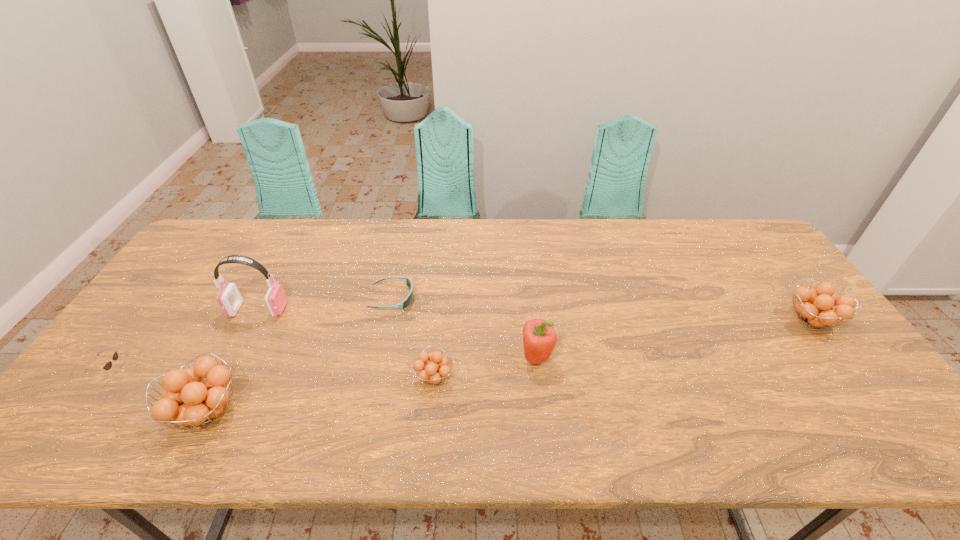
The height and width of the screenshot is (540, 960). Find the location of `the tallest object`. the tallest object is located at coordinates (229, 298).

In order to click on vacant area situated 0.380m on the right of the leftmost orange fruit in this screenshot , I will do `click(408, 411)`.

This screenshot has height=540, width=960. In order to click on free space located 0.090m on the left of the third object from right to left in this screenshot , I will do tap(378, 377).

Locate an element on the screen. Image resolution: width=960 pixels, height=540 pixels. blank space located on the left of the rightmost object is located at coordinates (684, 320).

Locate an element on the screen. This screenshot has height=540, width=960. free spot located 0.350m on the front-facing side of the farther sunglasses is located at coordinates (533, 299).

At what (x,y) coordinates should I click in order to perform the action: click on vacant region located on the right of the sixth object from left to right. Please return your answer as a coordinate pair (x, y). The image size is (960, 540). Looking at the image, I should click on (668, 358).

I want to click on free space located in front of the lenses of the nearer sunglasses, so click(x=187, y=373).

Find the location of a particular element. This screenshot has width=960, height=540. vacant space located on the outer surface of the earphone is located at coordinates coord(365,310).

This screenshot has height=540, width=960. In order to click on sunglasses present at the near edge in this screenshot , I will do `click(108, 365)`.

The height and width of the screenshot is (540, 960). In order to click on object that is at the left edge in this screenshot , I will do `click(108, 365)`.